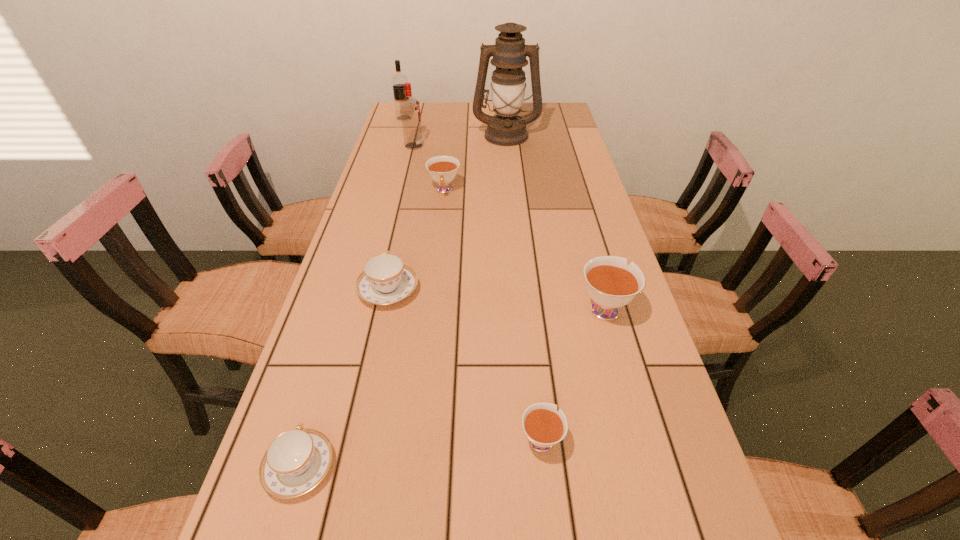
In order to click on oil lamp that is at the right edge in this screenshot , I will do `click(509, 53)`.

The width and height of the screenshot is (960, 540). What are the coordinates of `teacup situated at the right edge` in the screenshot? It's located at (611, 284).

Locate an element on the screen. The width and height of the screenshot is (960, 540). object located in the far left corner section of the desktop is located at coordinates (398, 80).

Image resolution: width=960 pixels, height=540 pixels. Identify the location of object present at the far right corner. (509, 53).

Find the location of a particular element. This screenshot has height=540, width=960. vacant area at the left edge is located at coordinates (415, 194).

The height and width of the screenshot is (540, 960). In order to click on free space at the right edge in this screenshot , I will do `click(589, 320)`.

In the image, there is a desktop. What are the coordinates of `blank space at the far left corner` in the screenshot? It's located at (389, 122).

Locate an element on the screen. The width and height of the screenshot is (960, 540). vacant space at the far right corner is located at coordinates (548, 118).

Where is `vacant area that lies between the red vodka and the nearer blue teacup`? vacant area that lies between the red vodka and the nearer blue teacup is located at coordinates (357, 307).

The image size is (960, 540). Find the location of `free point between the nearer blue teacup and the tallest object`. free point between the nearer blue teacup and the tallest object is located at coordinates (403, 301).